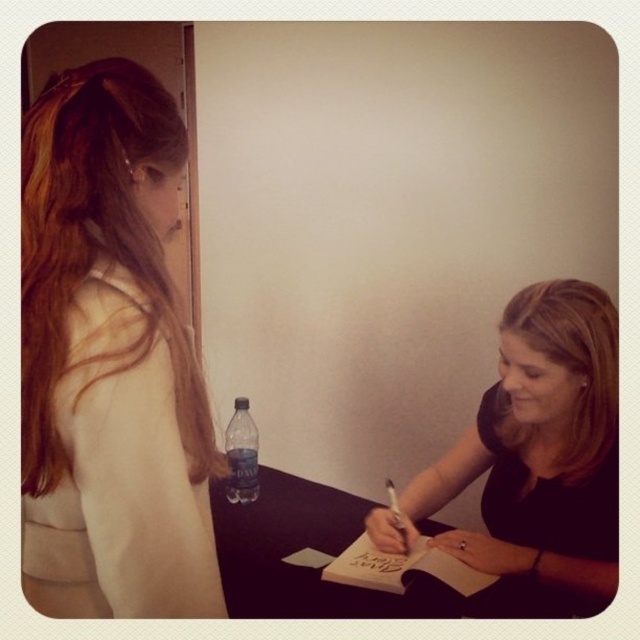
Question: Considering the relative positions of matte beige sweater at left and black matte pen at center in the image provided, where is matte beige sweater at left located with respect to black matte pen at center?

Choices:
 (A) above
 (B) below

Answer: (A)

Question: Does black matte table at center have a greater width compared to transparent plastic bottle at center?

Choices:
 (A) yes
 (B) no

Answer: (A)

Question: Estimate the real-world distances between objects in this image. Which object is farther from the smooth paper note at lower center?

Choices:
 (A) matte beige sweater at left
 (B) transparent plastic bottle at center
 (C) black matte table at center
 (D) black matte pen at center

Answer: (A)

Question: Does matte beige sweater at left have a greater width compared to transparent plastic bottle at center?

Choices:
 (A) no
 (B) yes

Answer: (B)

Question: Based on their relative distances, which object is nearer to the black matte pen at center?

Choices:
 (A) transparent plastic bottle at center
 (B) smooth paper note at lower center
 (C) black matte table at center
 (D) matte beige sweater at left

Answer: (C)

Question: Which point is farther to the camera?

Choices:
 (A) transparent plastic bottle at center
 (B) black matte pen at center
 (C) matte beige sweater at left
 (D) smooth paper note at lower center

Answer: (A)